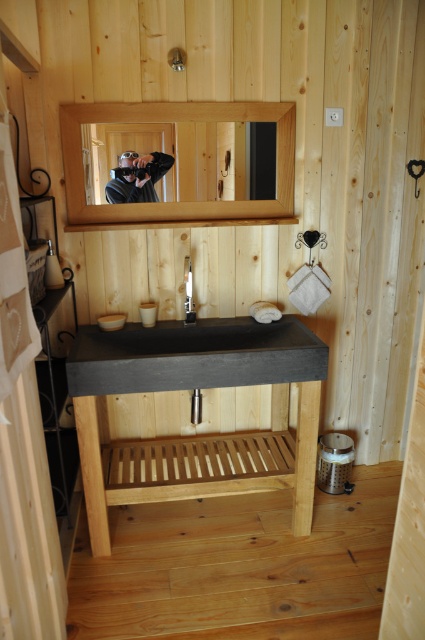
Which is in front, point (232, 460) or point (246, 328)?

Point (232, 460) is more forward.

From the picture: Between black concrete sink at center and dark concrete sink at center, which one appears on the right side from the viewer's perspective?

black concrete sink at center is more to the right.

Who is more distant from viewer, (198, 394) or (200, 326)?

The point (198, 394) is behind.

At what (x,y) coordinates should I click in order to perform the action: click on black concrete sink at center. Please return your answer as a coordinate pair (x, y). Looking at the image, I should click on (201, 435).

Does dark concrete sink at center come behind matte black camera at upper center?

No, dark concrete sink at center is in front of matte black camera at upper center.

Is point (70, 362) closer to viewer compared to point (142, 160)?

Yes, it is.

You are a GUI agent. You are given a task and a screenshot of the screen. Output one action in this format:
    pyautogui.click(x=<x>, y=<y>)
    Task: Click on the dark concrete sink at center
    
    Given the screenshot: What is the action you would take?
    pyautogui.click(x=193, y=355)

Does black concrete sink at center lie in front of clear glass mirror at upper center?

That is True.

Can you confirm if black concrete sink at center is wider than clear glass mirror at upper center?

Yes.

Find the location of a particular element. black concrete sink at center is located at coordinates (201, 435).